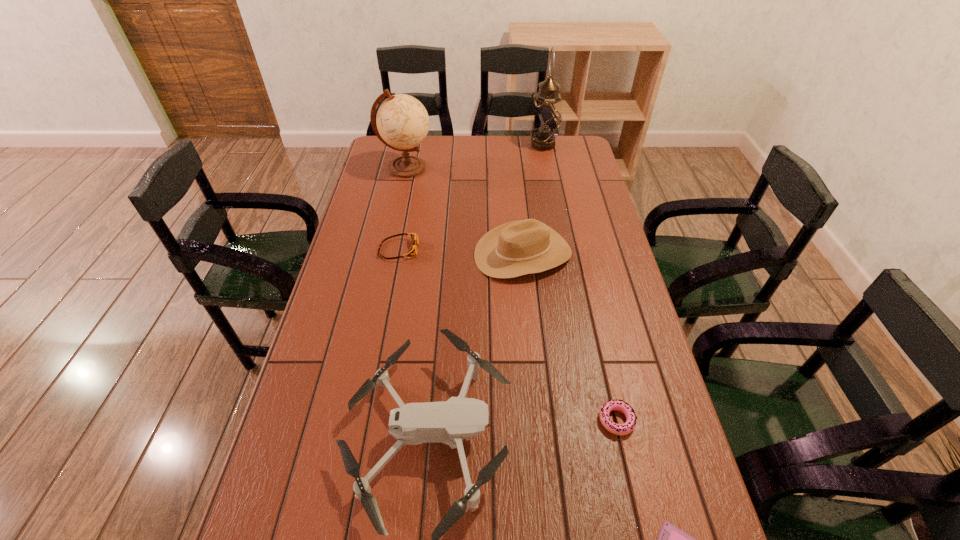
This screenshot has width=960, height=540. Identify the location of free space that satisfies the following two spatial constraints: 1. on the front side of the tallest object; 2. on the left side of the doughnut. (597, 420).

Locate an element on the screen. The image size is (960, 540). vacant space that satisfies the following two spatial constraints: 1. with the lenses facing forward on the fifth tallest object; 2. on the left side of the cowboy hat is located at coordinates (397, 254).